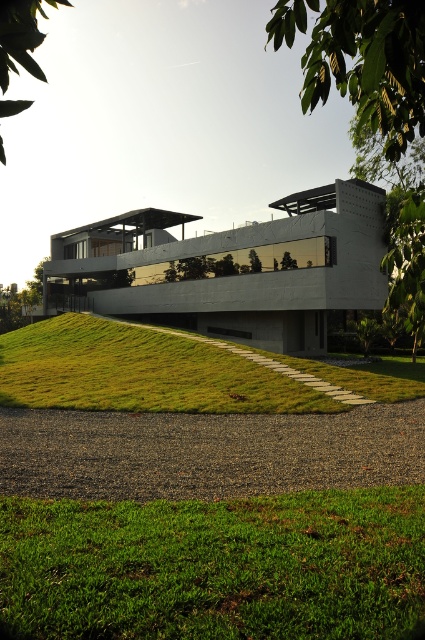
Question: Which point is closer to the camera taking this photo?

Choices:
 (A) (17, 570)
 (B) (20, 3)
 (C) (286, 360)

Answer: (B)

Question: Which point is farther to the camera?

Choices:
 (A) green leafy tree at upper right
 (B) green leafy tree at upper left
 (C) green grass at center

Answer: (C)

Question: Does green grassy at lower center appear on the right side of green grass at center?

Choices:
 (A) yes
 (B) no

Answer: (A)

Question: In this image, where is green grassy at lower center located relative to green leafy tree at upper left?

Choices:
 (A) above
 (B) below

Answer: (B)

Question: Which point appears closest to the camera in this image?

Choices:
 (A) (17, 56)
 (B) (399, 156)
 (C) (311, 586)
 (D) (40, 339)

Answer: (A)

Question: Is green grassy at lower center bigger than green leafy tree at upper right?

Choices:
 (A) yes
 (B) no

Answer: (B)